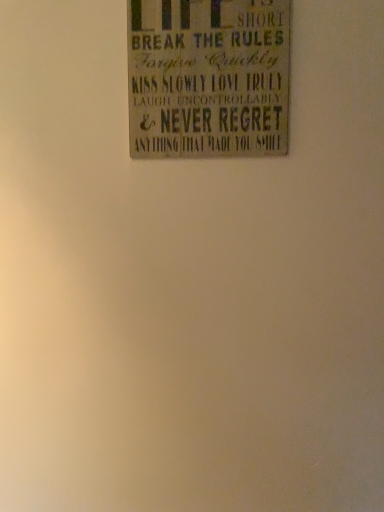
The height and width of the screenshot is (512, 384). I want to click on wooden signboard at upper center, so click(x=208, y=78).

This screenshot has height=512, width=384. What do you see at coordinates (208, 78) in the screenshot? I see `wooden signboard at upper center` at bounding box center [208, 78].

Locate an element on the screen. The width and height of the screenshot is (384, 512). wooden signboard at upper center is located at coordinates (208, 78).